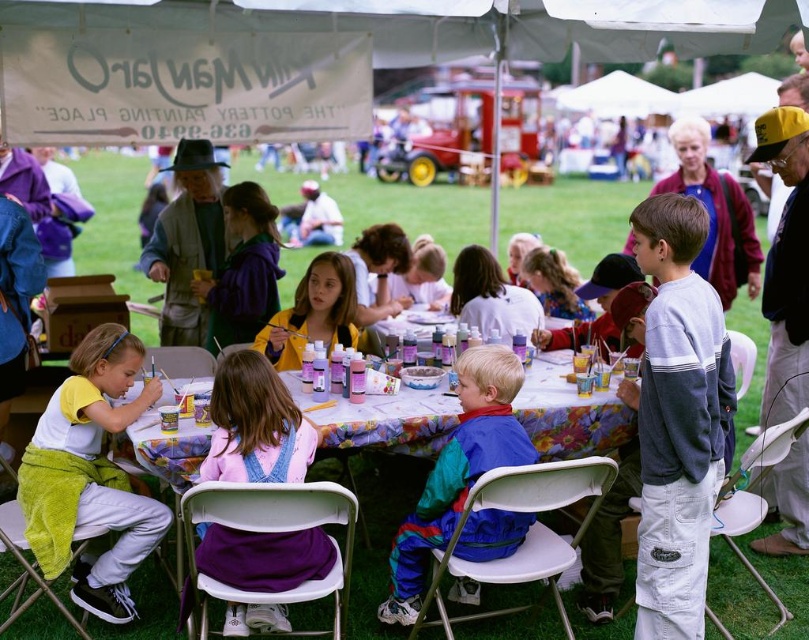
What do you see at coordinates (384, 420) in the screenshot?
I see `floral tablecloth at center` at bounding box center [384, 420].

Can you confirm if floral tablecloth at center is wider than rainbow nylon jacket at center?

Indeed, floral tablecloth at center has a greater width compared to rainbow nylon jacket at center.

Who is more forward, (293, 388) or (464, 545)?

Positioned in front is point (464, 545).

Find the location of a particular element. This screenshot has width=809, height=640. floral tablecloth at center is located at coordinates (384, 420).

Measure the distance between point [113,588] and camera.

They are 11.21 feet apart.

Where is `white cotton shirt at center`? The image size is (809, 640). white cotton shirt at center is located at coordinates [91, 474].

Is point (701, 554) positioned in front of point (405, 532)?

Yes, point (701, 554) is in front of point (405, 532).

The height and width of the screenshot is (640, 809). What are the coordinates of `gray cotton sweatshirt at right` in the screenshot? It's located at 678,419.

You are a GUI agent. You are given a task and a screenshot of the screen. Output one action in this format:
    pyautogui.click(x=<x>, y=<y>)
    Task: Click on the gray cotton sweatshirt at right
    This screenshot has width=809, height=640.
    Given the screenshot: What is the action you would take?
    pyautogui.click(x=678, y=419)